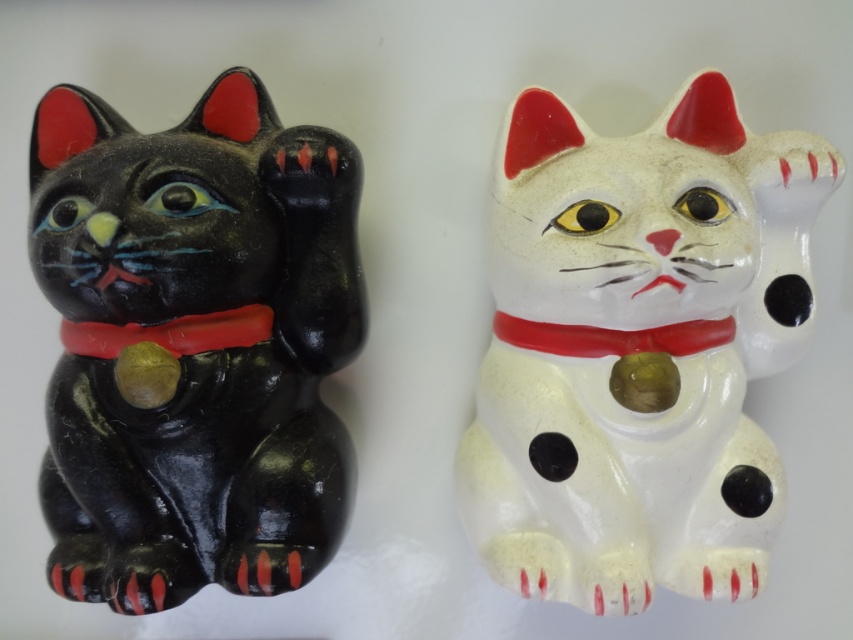
Question: Which of the following is the farthest from the observer?

Choices:
 (A) white glossy cat at upper center
 (B) rubber-like red neckband at left

Answer: (B)

Question: Does shiny black cat at left lie in front of rubber-like red neckband at left?

Choices:
 (A) no
 (B) yes

Answer: (B)

Question: Does white glossy cat at upper center have a larger size compared to rubber-like red neckband at left?

Choices:
 (A) yes
 (B) no

Answer: (A)

Question: Estimate the real-world distances between objects in this image. Which object is farther from the red glossy neckband at center?

Choices:
 (A) white glossy cat at upper center
 (B) rubber-like red neckband at left
 (C) shiny black cat at left

Answer: (C)

Question: Considering the relative positions of red glossy neckband at center and rubber-like red neckband at left in the image provided, where is red glossy neckband at center located with respect to rubber-like red neckband at left?

Choices:
 (A) above
 (B) below

Answer: (A)

Question: Which object appears closest to the camera in this image?

Choices:
 (A) white glossy cat at upper center
 (B) shiny black cat at left
 (C) red glossy neckband at center

Answer: (B)